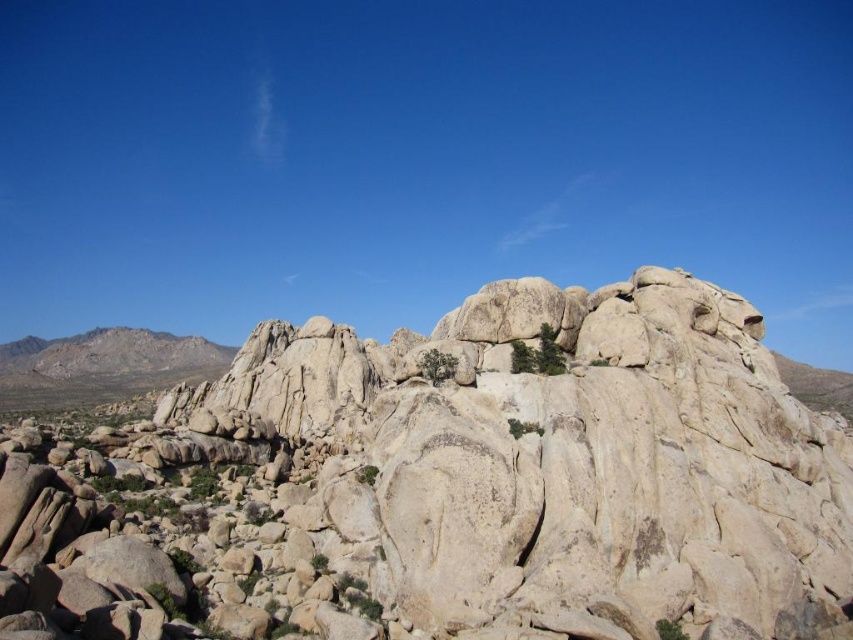
Question: Is granite rock formation at center behind rugged stone mountain at left?

Choices:
 (A) no
 (B) yes

Answer: (A)

Question: Is granite rock formation at center above rugged stone mountain at left?

Choices:
 (A) yes
 (B) no

Answer: (A)

Question: Does granite rock formation at center come behind rugged stone mountain at left?

Choices:
 (A) yes
 (B) no

Answer: (B)

Question: Which point appears farthest from the camera in this image?

Choices:
 (A) (111, 342)
 (B) (15, 554)

Answer: (A)

Question: Which point is farther to the camera?

Choices:
 (A) (347, 634)
 (B) (90, 349)

Answer: (B)